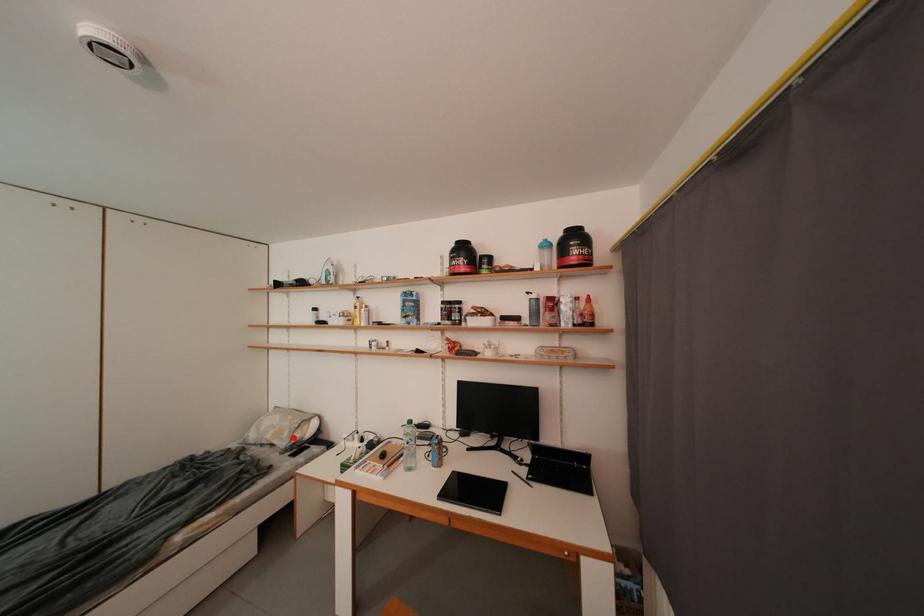
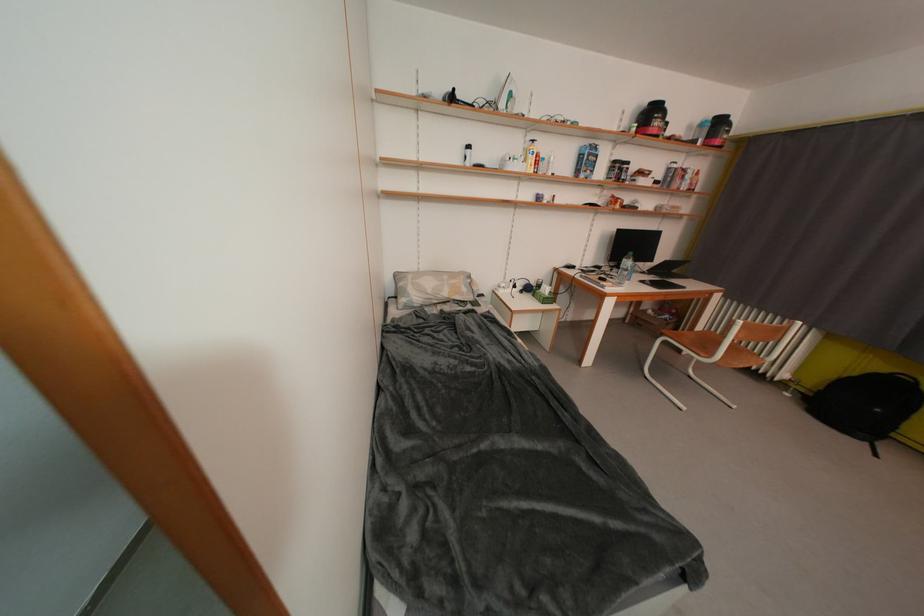
Question: I am providing you with two images of the same scene from different viewpoints. In image1, a red point is highlighted. Considering the same 3D point in image2, which of the following is correct?

Choices:
 (A) It is closer
 (B) It is farther

Answer: (A)